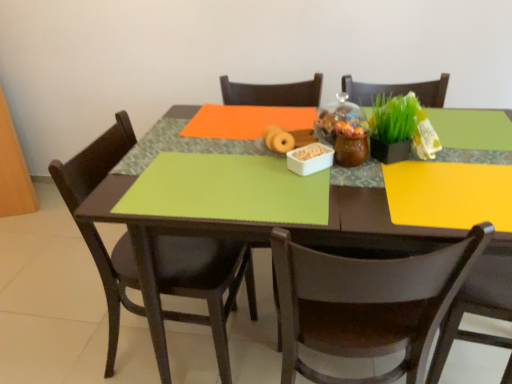
Locate an element on the screen. blank space situated above green matte table at center (from a real-world perspective) is located at coordinates (326, 166).